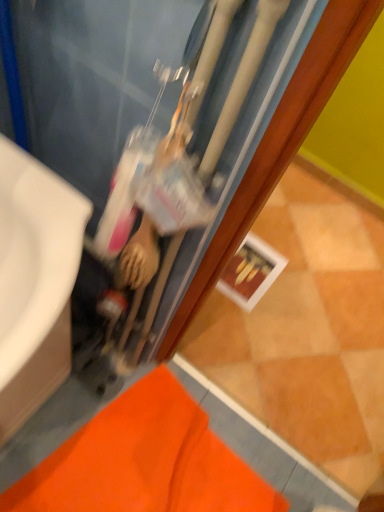
Identify the location of blank space situated above orange fabric bath mat at lower left (from a real-world perspective). (146, 460).